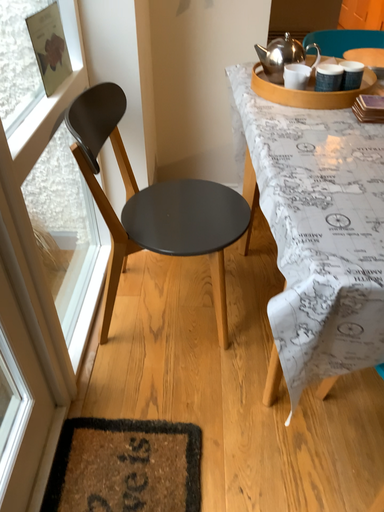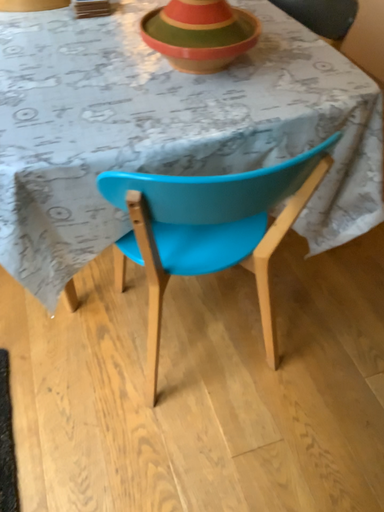
Question: How did the camera likely rotate when shooting the video?

Choices:
 (A) rotated upward
 (B) rotated downward

Answer: (B)